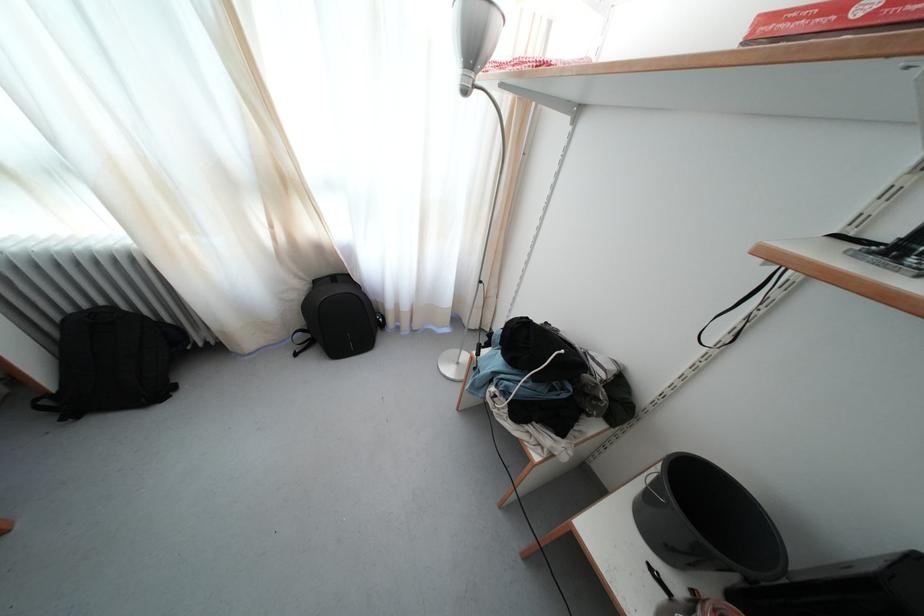
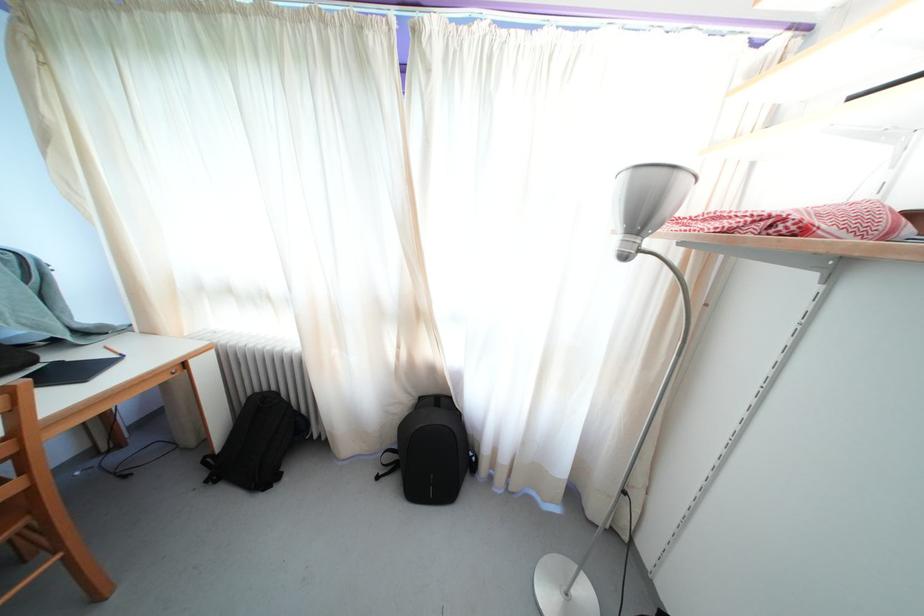
In the second image, find the point that corresponds to the point at 322,288 in the first image.

(427, 405)